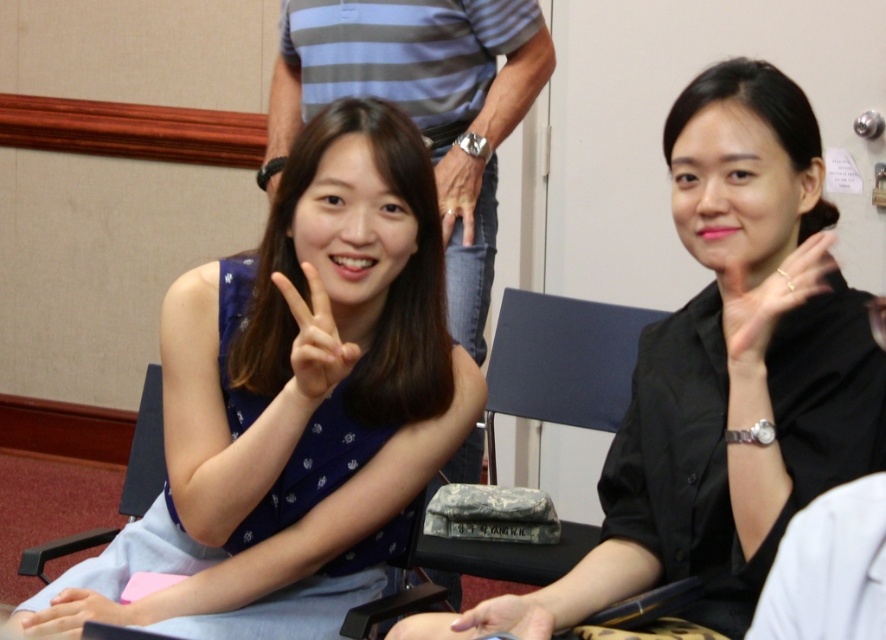
Does blue dotted dress at left appear under camouflage fabric bag at center?

Actually, blue dotted dress at left is above camouflage fabric bag at center.

Can you confirm if blue dotted dress at left is positioned above camouflage fabric bag at center?

Yes.

Does point (320, 518) come behind point (530, 397)?

No, it is in front of (530, 397).

In order to click on blue dotted dress at left in this screenshot , I will do `click(299, 403)`.

Which is above, blue striped shirt at upper center or gold metallic ring at right?

blue striped shirt at upper center is above.

Which is in front, point (368, 86) or point (750, 320)?

Point (750, 320) is more forward.

This screenshot has height=640, width=886. Find the location of `blue striped shirt at upper center`. blue striped shirt at upper center is located at coordinates (422, 106).

Does camouflage fabric bag at center have a larger size compared to blue fabric chair at left?

Correct, camouflage fabric bag at center is larger in size than blue fabric chair at left.

Which is more to the right, camouflage fabric bag at center or blue fabric chair at left?

camouflage fabric bag at center is more to the right.

The image size is (886, 640). What do you see at coordinates (561, 362) in the screenshot? I see `camouflage fabric bag at center` at bounding box center [561, 362].

Identify the location of camouflage fabric bag at center. (561, 362).